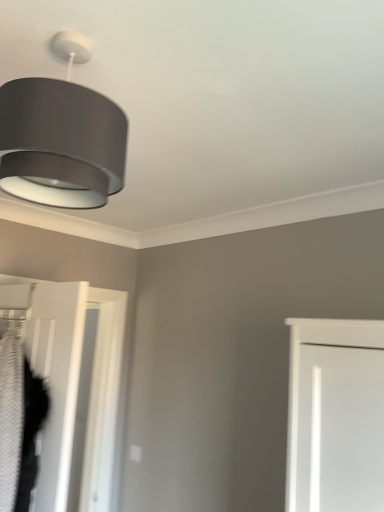
Question: Considering the relative sizes of matte gray lampshade at upper left and white textured door at lower left in the image provided, is matte gray lampshade at upper left shorter than white textured door at lower left?

Choices:
 (A) yes
 (B) no

Answer: (A)

Question: Is matte gray lampshade at upper left facing away from white textured door at lower left?

Choices:
 (A) yes
 (B) no

Answer: (B)

Question: Considering the relative positions of matte gray lampshade at upper left and white textured door at lower left in the image provided, is matte gray lampshade at upper left to the left of white textured door at lower left from the viewer's perspective?

Choices:
 (A) yes
 (B) no

Answer: (B)

Question: Considering the relative sizes of matte gray lampshade at upper left and white textured door at lower left in the image provided, is matte gray lampshade at upper left wider than white textured door at lower left?

Choices:
 (A) no
 (B) yes

Answer: (B)

Question: Could white textured door at lower left be considered to be inside matte gray lampshade at upper left?

Choices:
 (A) no
 (B) yes

Answer: (A)

Question: Is matte gray lampshade at upper left oriented towards white textured door at lower left?

Choices:
 (A) no
 (B) yes

Answer: (A)

Question: Considering the relative sizes of white textured door at lower left and matte gray lampshade at upper left in the image provided, is white textured door at lower left bigger than matte gray lampshade at upper left?

Choices:
 (A) no
 (B) yes

Answer: (B)

Question: Can you see white textured door at lower left touching matte gray lampshade at upper left?

Choices:
 (A) no
 (B) yes

Answer: (A)

Question: Can you confirm if white textured door at lower left is smaller than matte gray lampshade at upper left?

Choices:
 (A) no
 (B) yes

Answer: (A)

Question: Is white textured door at lower left in front of matte gray lampshade at upper left?

Choices:
 (A) no
 (B) yes

Answer: (A)

Question: From a real-world perspective, is white textured door at lower left positioned under matte gray lampshade at upper left based on gravity?

Choices:
 (A) yes
 (B) no

Answer: (A)

Question: Is white textured door at lower left thinner than matte gray lampshade at upper left?

Choices:
 (A) yes
 (B) no

Answer: (A)

Question: Is white textured door at lower left spatially inside matte gray lampshade at upper left, or outside of it?

Choices:
 (A) outside
 (B) inside

Answer: (A)